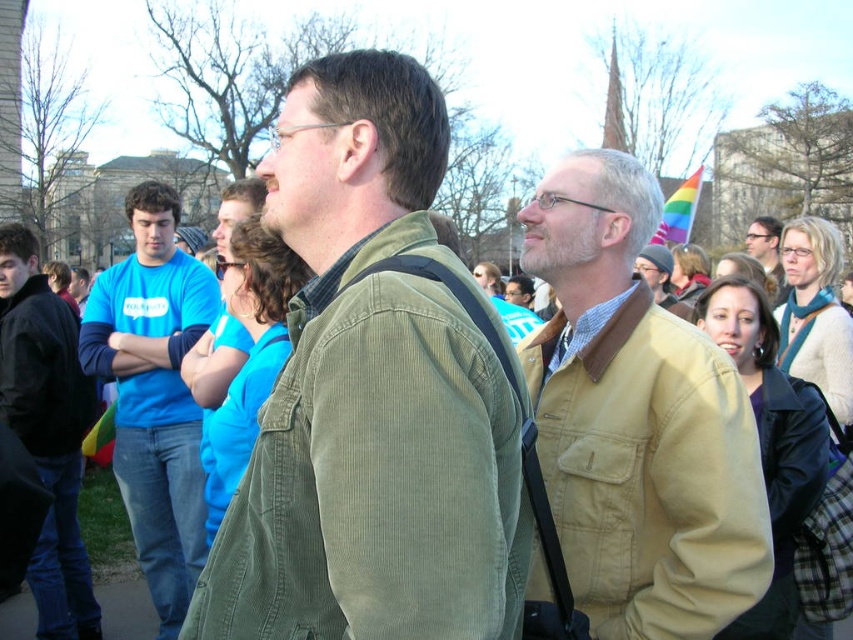
Looking at this image, is blue cotton shirt at left taller than matte blue shirt at left?

Yes, blue cotton shirt at left is taller than matte blue shirt at left.

This screenshot has height=640, width=853. What do you see at coordinates (154, 392) in the screenshot?
I see `blue cotton shirt at left` at bounding box center [154, 392].

Where is `blue cotton shirt at left`? Image resolution: width=853 pixels, height=640 pixels. blue cotton shirt at left is located at coordinates (154, 392).

Looking at this image, is green corduroy jacket at center to the right of blue cotton shirt at left from the viewer's perspective?

Indeed, green corduroy jacket at center is positioned on the right side of blue cotton shirt at left.

Is point (450, 602) in front of point (119, 435)?

Yes, it is.

Find the location of a particular element. The width and height of the screenshot is (853, 640). green corduroy jacket at center is located at coordinates (370, 396).

Does matte blue shirt at left come in front of light brown leather jacket at center?

Yes, it is in front of light brown leather jacket at center.

Does matte blue shirt at left appear on the left side of light brown leather jacket at center?

Yes, matte blue shirt at left is to the left of light brown leather jacket at center.

Is point (93, 612) farther from camera compared to point (776, 305)?

No, it is in front of (776, 305).

I want to click on matte blue shirt at left, so click(x=47, y=429).